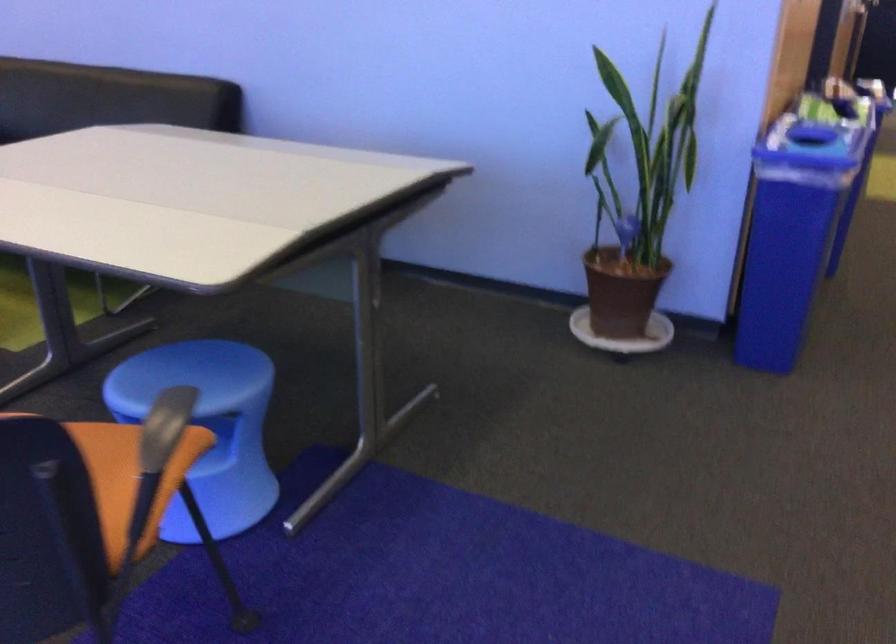
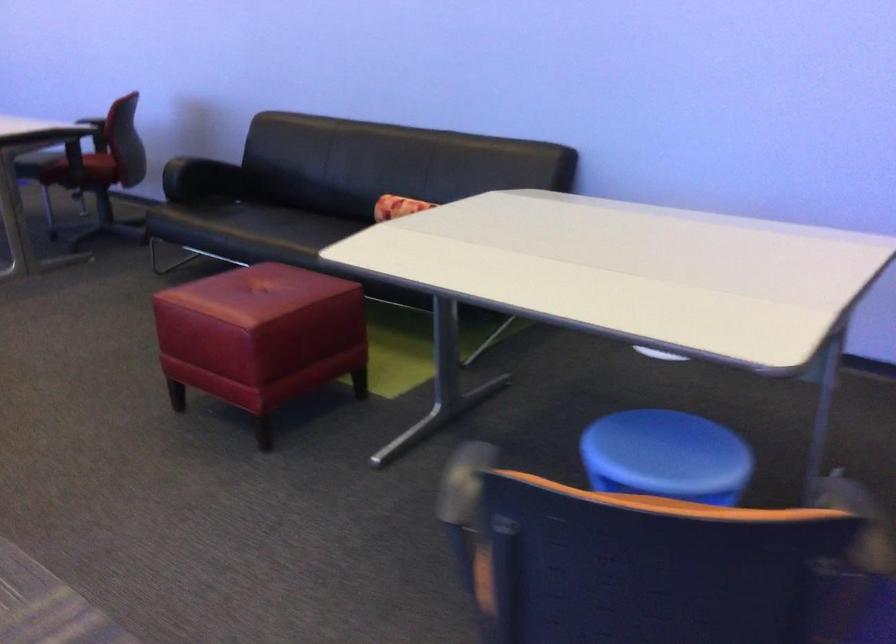
Question: What movement of the cameraman would produce the second image?

Choices:
 (A) Left
 (B) Right
 (C) Forward
 (D) Backward

Answer: (A)